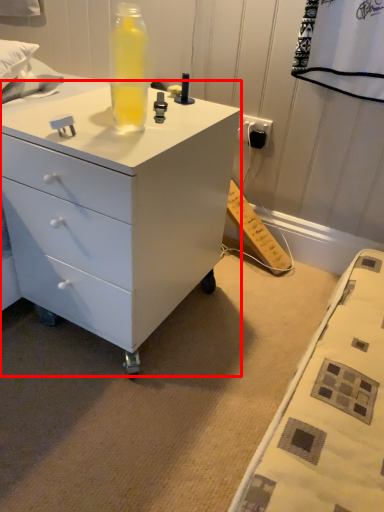
Question: Where is chest of drawers (annotated by the red box) located in relation to bottle in the image?

Choices:
 (A) right
 (B) left

Answer: (B)